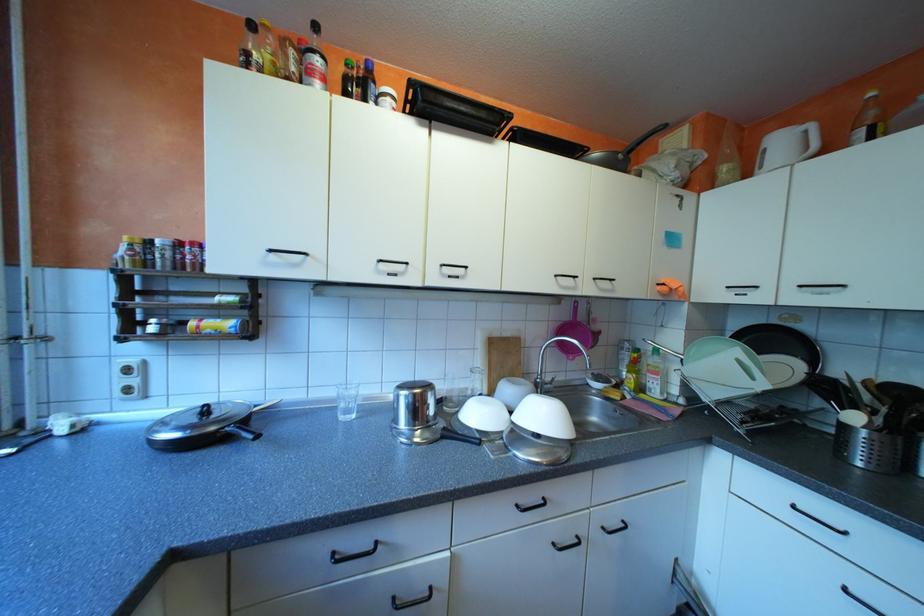
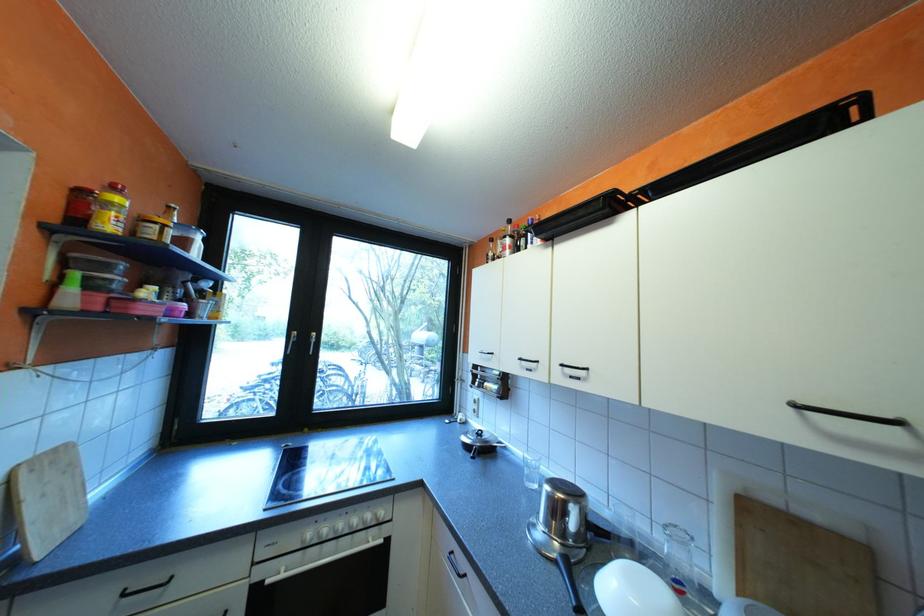
Locate, in the second image, the point that corresponds to (455,274) in the first image.

(576, 373)